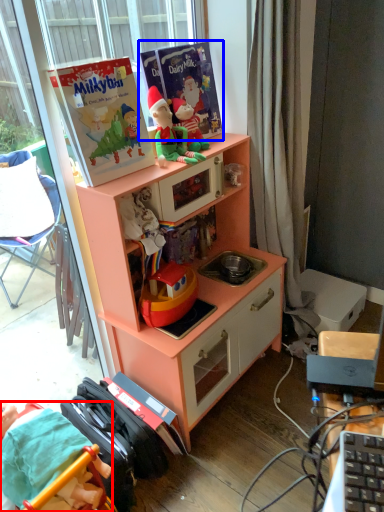
Question: Which object is further to the camera taking this photo, person (highlighted by a red box) or paperback book (highlighted by a blue box)?

Choices:
 (A) person
 (B) paperback book

Answer: (B)